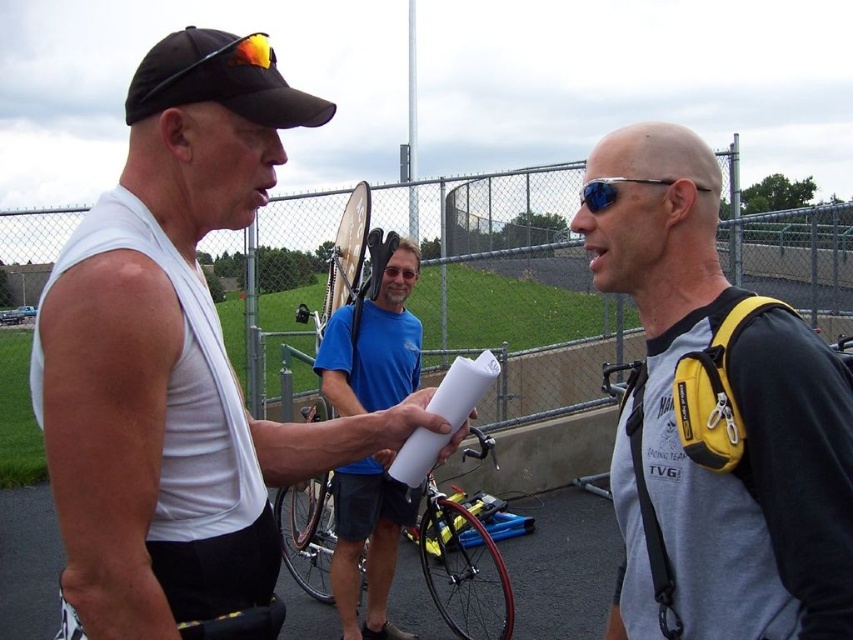
Between white matte tank top at center and shiny red bicycle at center, which one is positioned lower?

Positioned lower is shiny red bicycle at center.

Is white matte tank top at center taller than shiny red bicycle at center?

Yes, white matte tank top at center is taller than shiny red bicycle at center.

Does point (218, 330) lie behind point (360, 570)?

No, it is in front of (360, 570).

Locate an element on the screen. white matte tank top at center is located at coordinates (173, 358).

Which is more to the right, shiny red bicycle at center or black matte baseball cap at upper left?

shiny red bicycle at center

Which is in front, point (486, 589) or point (259, 32)?

Point (486, 589) is more forward.

Find the location of `shiny red bicycle at center`. shiny red bicycle at center is located at coordinates click(x=462, y=568).

Does blue fabric shirt at center lie in front of black matte baseball cap at upper left?

No, blue fabric shirt at center is behind black matte baseball cap at upper left.

Is blue fabric shirt at center wider than black matte baseball cap at upper left?

Correct, the width of blue fabric shirt at center exceeds that of black matte baseball cap at upper left.

Is point (413, 340) more distant than point (177, 90)?

That is True.

You are a GUI agent. You are given a task and a screenshot of the screen. Output one action in this format:
    pyautogui.click(x=<x>, y=<y>)
    Task: Click on the blue fabric shirt at center
    The height and width of the screenshot is (640, 853).
    Given the screenshot: What is the action you would take?
    pyautogui.click(x=374, y=344)